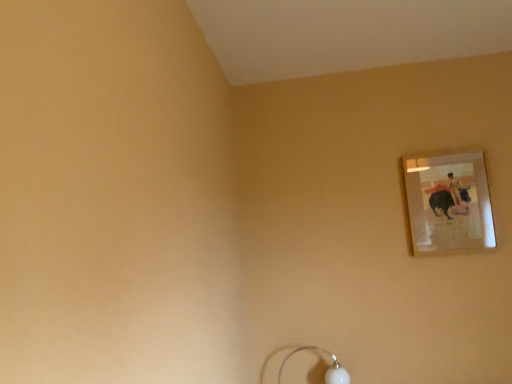
The image size is (512, 384). What do you see at coordinates (320, 373) in the screenshot?
I see `white glossy lamp at lower center` at bounding box center [320, 373].

The width and height of the screenshot is (512, 384). In order to click on white glossy lamp at lower center in this screenshot , I will do `click(320, 373)`.

The image size is (512, 384). What do you see at coordinates (449, 203) in the screenshot?
I see `matte glass picture frame at upper right` at bounding box center [449, 203].

You are a GUI agent. You are given a task and a screenshot of the screen. Output one action in this format:
    pyautogui.click(x=<x>, y=<y>)
    Task: Click on the matte glass picture frame at upper right
    
    Given the screenshot: What is the action you would take?
    pyautogui.click(x=449, y=203)

Where is `white glossy lamp at lower center`? white glossy lamp at lower center is located at coordinates (320, 373).

Does matte glass picture frame at upper right appear on the right side of white glossy lamp at lower center?

Correct, you'll find matte glass picture frame at upper right to the right of white glossy lamp at lower center.

Relative to white glossy lamp at lower center, is matte glass picture frame at upper right in front or behind?

matte glass picture frame at upper right is behind white glossy lamp at lower center.

Is point (460, 224) positioned in front of point (324, 381)?

That is True.

From the image's perspective, is matte glass picture frame at upper right located above or below white glossy lamp at lower center?

Clearly, from the image's perspective, matte glass picture frame at upper right is above white glossy lamp at lower center.

From a real-world perspective, is matte glass picture frame at upper right positioned over white glossy lamp at lower center based on gravity?

Correct, in the physical world, matte glass picture frame at upper right is higher than white glossy lamp at lower center.

Looking at their sizes, would you say matte glass picture frame at upper right is wider or thinner than white glossy lamp at lower center?

In the image, matte glass picture frame at upper right appears to be more narrow than white glossy lamp at lower center.

In terms of height, does matte glass picture frame at upper right look taller or shorter compared to white glossy lamp at lower center?

Considering their sizes, matte glass picture frame at upper right has more height than white glossy lamp at lower center.

Who is smaller, matte glass picture frame at upper right or white glossy lamp at lower center?

matte glass picture frame at upper right is smaller.

Is matte glass picture frame at upper right outside of white glossy lamp at lower center?

matte glass picture frame at upper right lies outside white glossy lamp at lower center's area.

Is matte glass picture frame at upper right next to white glossy lamp at lower center?

No.

Could you tell me if matte glass picture frame at upper right is facing white glossy lamp at lower center?

No, matte glass picture frame at upper right is not turned towards white glossy lamp at lower center.

Measure the distance between matte glass picture frame at upper right and white glossy lamp at lower center.

The distance of matte glass picture frame at upper right from white glossy lamp at lower center is 37.75 inches.

Identify the location of lamp in front of the matte glass picture frame at upper right. (320, 373).

Between white glossy lamp at lower center and matte glass picture frame at upper right, which one appears on the left side from the viewer's perspective?

white glossy lamp at lower center is more to the left.

Considering their positions, is white glossy lamp at lower center located in front of or behind matte glass picture frame at upper right?

Visually, white glossy lamp at lower center is located in front of matte glass picture frame at upper right.

Is point (308, 350) more distant than point (424, 237)?

That is True.

From the image's perspective, is white glossy lamp at lower center above matte glass picture frame at upper right?

Incorrect, from the image's perspective, white glossy lamp at lower center is lower than matte glass picture frame at upper right.

From a real-world perspective, is white glossy lamp at lower center above or below matte glass picture frame at upper right?

From a real-world perspective, white glossy lamp at lower center is physically below matte glass picture frame at upper right.

Which of these two, white glossy lamp at lower center or matte glass picture frame at upper right, is wider?

Wider between the two is white glossy lamp at lower center.

Considering the relative sizes of white glossy lamp at lower center and matte glass picture frame at upper right in the image provided, is white glossy lamp at lower center taller than matte glass picture frame at upper right?

No, white glossy lamp at lower center is not taller than matte glass picture frame at upper right.

Does white glossy lamp at lower center have a smaller size compared to matte glass picture frame at upper right?

No, white glossy lamp at lower center is not smaller than matte glass picture frame at upper right.

In the scene shown: Is white glossy lamp at lower center inside or outside of matte glass picture frame at upper right?

white glossy lamp at lower center lies outside matte glass picture frame at upper right.

Is white glossy lamp at lower center touching matte glass picture frame at upper right?

There is a gap between white glossy lamp at lower center and matte glass picture frame at upper right.

Is white glossy lamp at lower center oriented towards matte glass picture frame at upper right?

No, white glossy lamp at lower center does not turn towards matte glass picture frame at upper right.

How distant is white glossy lamp at lower center from matte glass picture frame at upper right?

white glossy lamp at lower center is 95.88 centimeters from matte glass picture frame at upper right.

Locate an element on the screen. The height and width of the screenshot is (384, 512). lamp below the matte glass picture frame at upper right (from the image's perspective) is located at coordinates (320, 373).

Where is `lamp that is in front of the matte glass picture frame at upper right`? lamp that is in front of the matte glass picture frame at upper right is located at coordinates (320, 373).

Where is `picture frame on the right of white glossy lamp at lower center`? This screenshot has height=384, width=512. picture frame on the right of white glossy lamp at lower center is located at coordinates (449, 203).